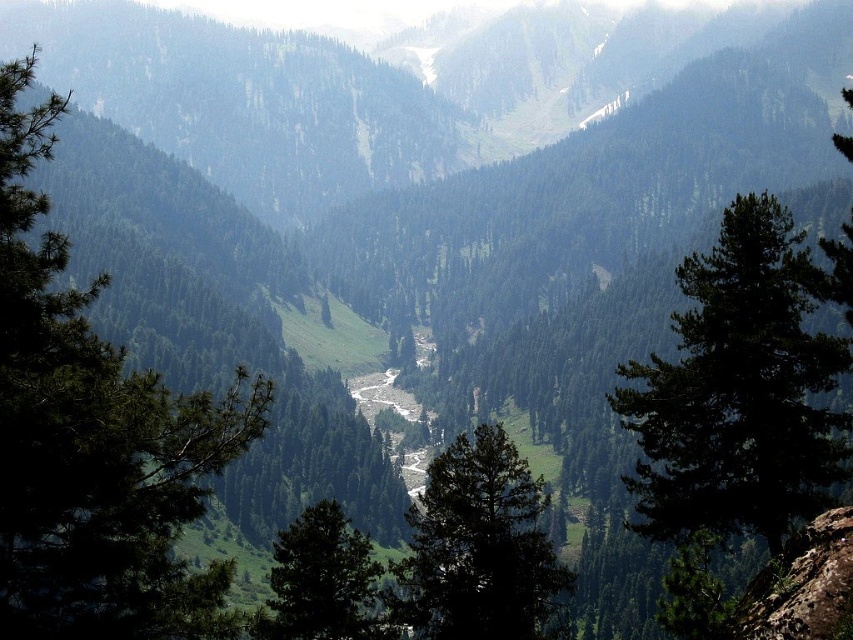
You are standing at the center of the valley and want to take a photo of the green leafy tree at center. Which direction should you face to ensure the tree is in the center of your photo?

The green leafy tree at center is already positioned at the center of the image, so facing directly towards it from the valley center will keep it centered in the photo.

You are standing at the point marked by the coordinates point (479, 547) and want to walk towards the green leafy tree at center. Which direction should you go?

The green leafy tree at center is represented by point (479, 547), so you are already at the location of the green leafy tree at center. You don not need to move in any direction.

You are standing at the highest point of the mountain and looking down at the valley. You notice two points marked on the landscape. Which point, point (695,435) or point (357,611), is closer to your current position?

Point (695,435) is closer to the viewer than point (357,611), so the point closer to your current position is point (695,435).